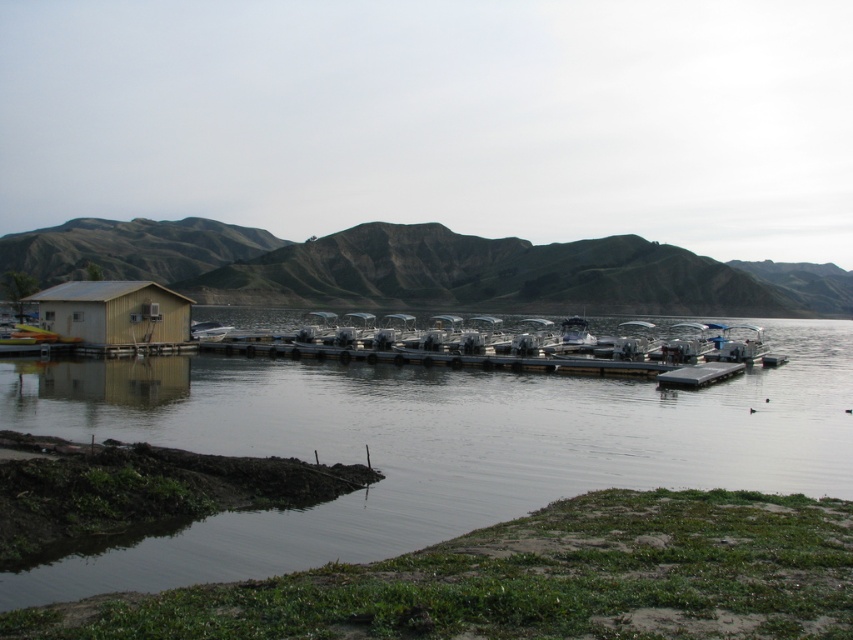
You are standing at the light brown wooden hut at left and want to reach the clear water at lower left. The path is straight and unobstructed. Can you walk directly to the water without any obstacles?

The clear water at lower left is 38.88 feet away from the light brown wooden hut at left, so yes, you can walk directly to the water without any obstacles since the path is straight and unobstructed.

You are standing at the edge of the lakeside and want to take a photo of the light brown wooden hut at left and the clear water at lower left. Which object should you focus on first if you want to capture both in one frame?

You should focus on the light brown wooden hut at left first because the clear water at lower left is below it, so adjusting focus from the hut downward will ensure both are in the frame.